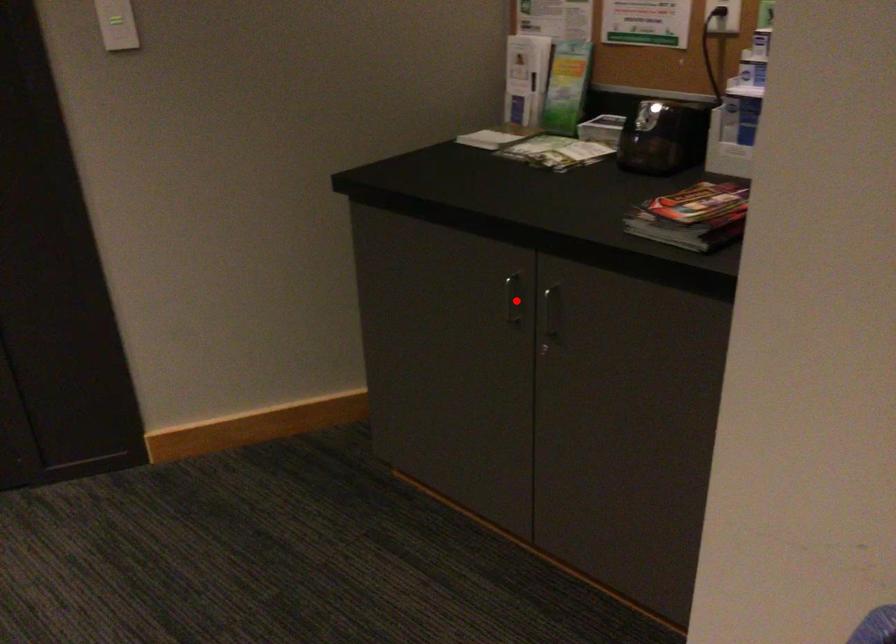
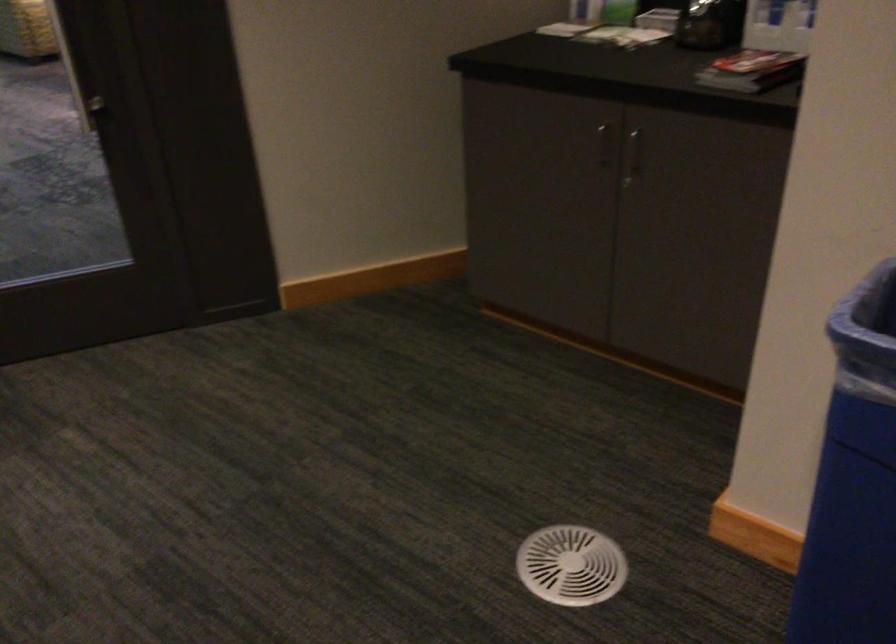
Question: I am providing you with two images of the same scene from different viewpoints. A red point is marked on the first image. At the location where the point appears in image 1, is it still visible in image 2?

Choices:
 (A) Yes
 (B) No

Answer: (A)